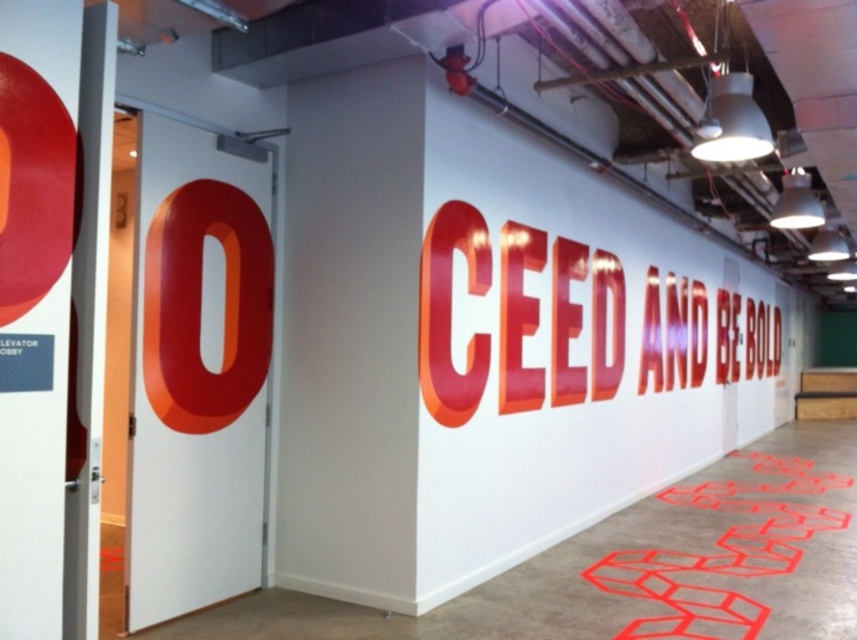
You are an interior designer assessing the space. You need to hang a large painting that requires at least 2 meters of vertical space. Given the shiny metallic letters at center and the red glossy hexagons at lower right, which object would be the better choice for placement considering their height?

The shiny metallic letters at center is much taller than the red glossy hexagons at lower right, so it would provide sufficient vertical space for the large painting requiring at least 2 meters.

You are an office manager planning to install a new light fixture. You notice the shiny metallic letters at center and the red glossy hexagons at lower right. Which object should you avoid placing the light fixture directly above to prevent casting a shadow on it?

You should avoid placing the light fixture directly above the shiny metallic letters at center because it is located above the red glossy hexagons at lower right, so shining light on it would cast a shadow on the hexagons below.

You are an interior designer planning to place a new desk in this office. The desk will be placed between the shiny metallic letters at center and the red glossy hexagons at lower right. Based on their positions, which object should the desk be closer to?

The desk should be closer to the red glossy hexagons at lower right because the shiny metallic letters at center is positioned on the right side of the red glossy hexagons at lower right, meaning the hexagons are to the left of the letters. Therefore, placing the desk between them would require it to be closer to the hexagons to maintain the spatial relationship.